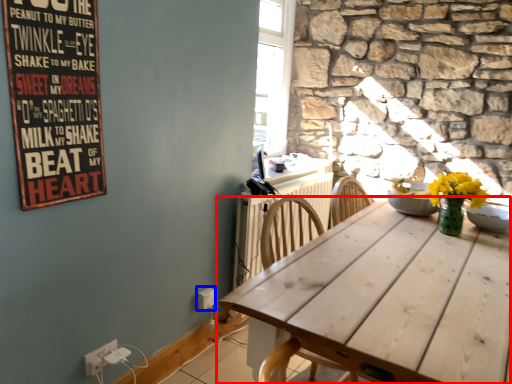
Question: Which of the following is the closest to the observer, table (highlighted by a red box) or electric outlet (highlighted by a blue box)?

Choices:
 (A) table
 (B) electric outlet

Answer: (A)